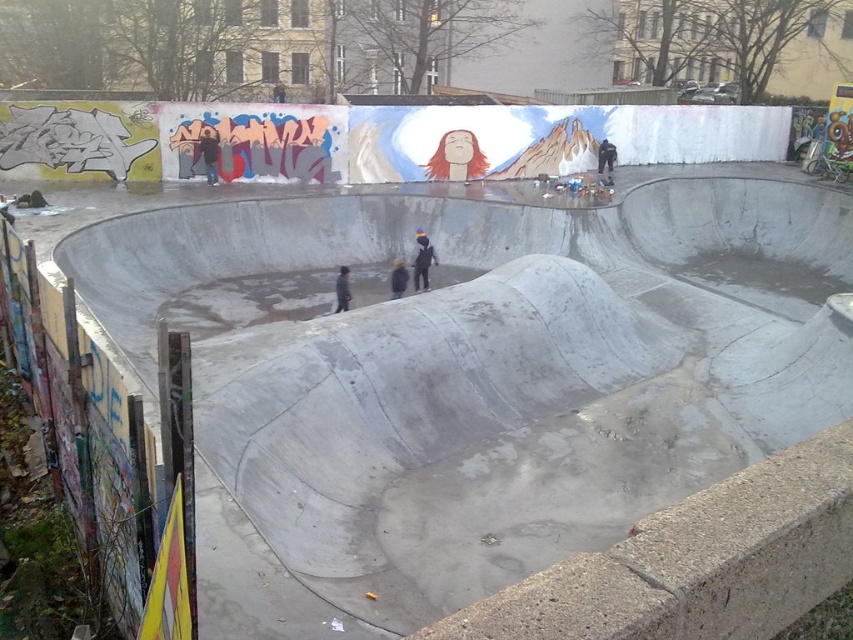
Which is more to the right, dark blue jacket at upper left or dark gray concrete skateboarder at center?

dark gray concrete skateboarder at center

This screenshot has width=853, height=640. What do you see at coordinates (209, 156) in the screenshot? I see `dark blue jacket at upper left` at bounding box center [209, 156].

Find the location of `dark blue jacket at upper left`. dark blue jacket at upper left is located at coordinates (209, 156).

Who is higher up, concrete skate park at center or dark gray concrete skateboarder at center?

Positioned higher is concrete skate park at center.

Is concrete skate park at center positioned behind dark gray concrete skateboarder at center?

No, concrete skate park at center is in front of dark gray concrete skateboarder at center.

Identify the location of concrete skate park at center. This screenshot has height=640, width=853. (473, 388).

Which is above, dark gray jacket at center or dark blue jacket at upper center?

Positioned higher is dark blue jacket at upper center.

Between point (340, 275) and point (599, 154), which one is positioned behind?

Positioned behind is point (599, 154).

Where is `dark gray jacket at center`? dark gray jacket at center is located at coordinates (341, 289).